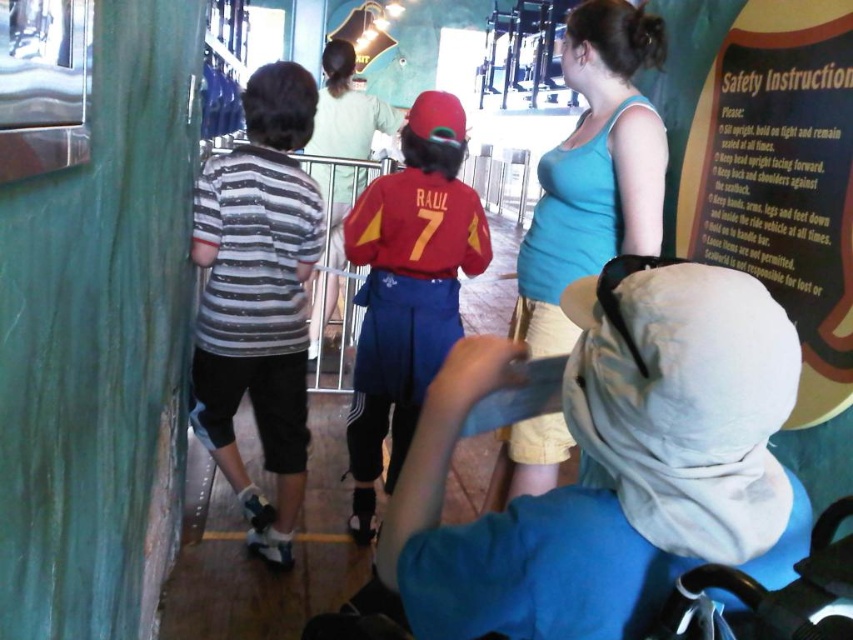
Question: Among these points, which one is farthest from the camera?

Choices:
 (A) (364, 413)
 (B) (602, 262)

Answer: (A)

Question: Which point is closer to the camera?

Choices:
 (A) (292, 298)
 (B) (397, 317)

Answer: (A)

Question: Does blue cotton tank top at upper center appear on the right side of matte red cap at center?

Choices:
 (A) yes
 (B) no

Answer: (A)

Question: Does striped cotton shirt at left have a smaller size compared to matte red cap at center?

Choices:
 (A) yes
 (B) no

Answer: (A)

Question: Is blue cotton tank top at upper center smaller than matte red cap at center?

Choices:
 (A) no
 (B) yes

Answer: (B)

Question: Which point is farther from the camera taking this photo?

Choices:
 (A) (262, 113)
 (B) (415, 376)

Answer: (B)